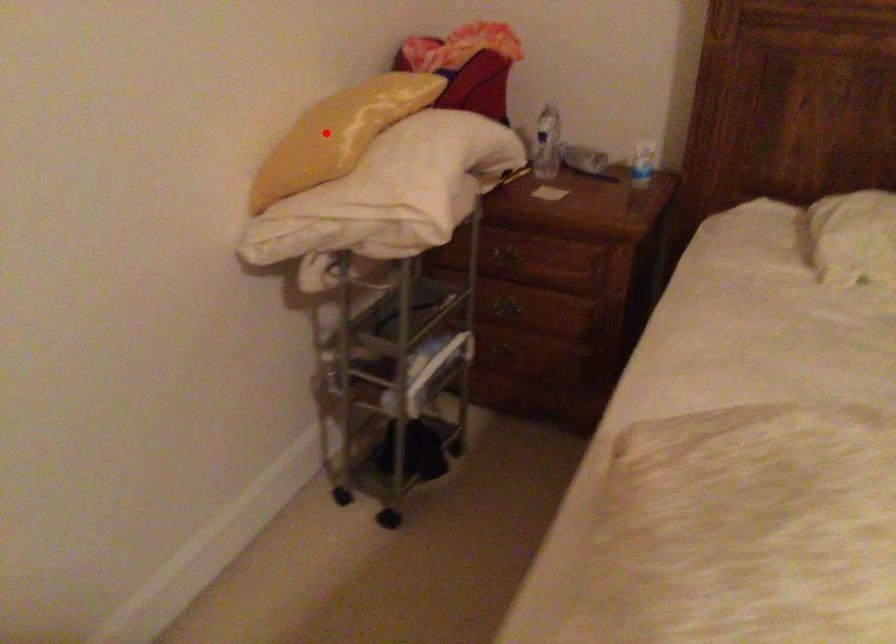
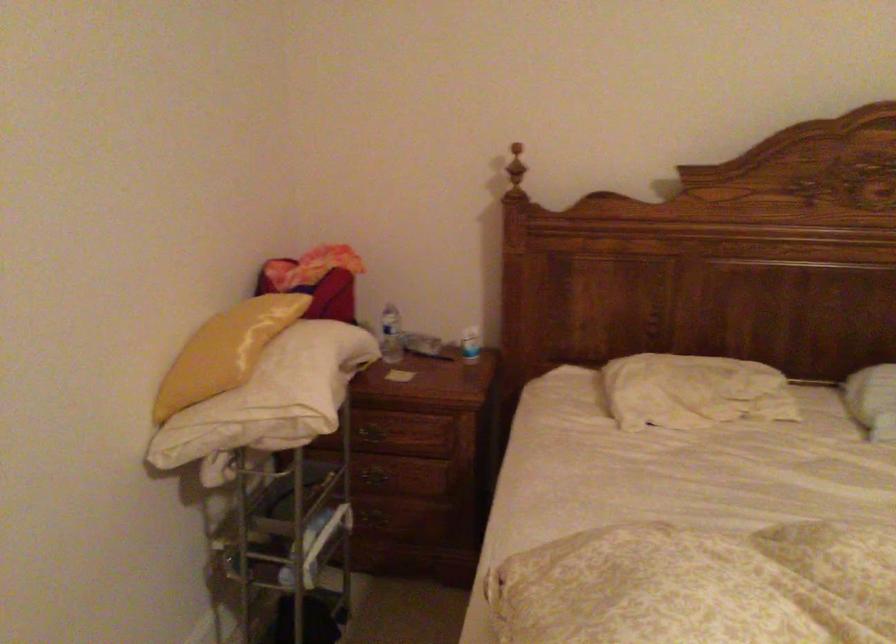
Question: I am providing you with two images of the same scene from different viewpoints. Image1 has a red point marked. In image2, the corresponding 3D location appears at what relative position? Reply with the corresponding letter.

Choices:
 (A) Closer
 (B) Farther

Answer: (B)